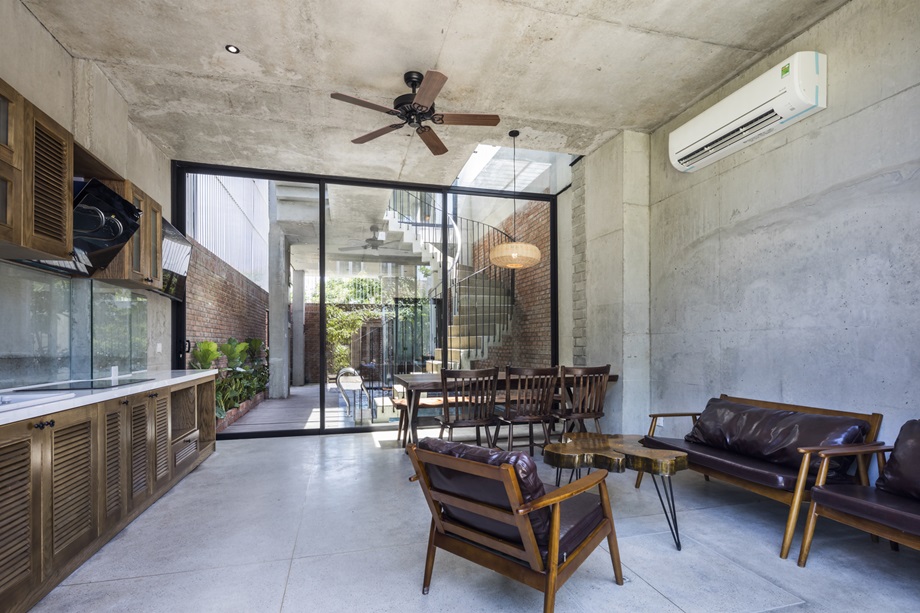
Where is `glass doors`? The height and width of the screenshot is (613, 920). glass doors is located at coordinates (293, 287), (388, 287), (476, 301).